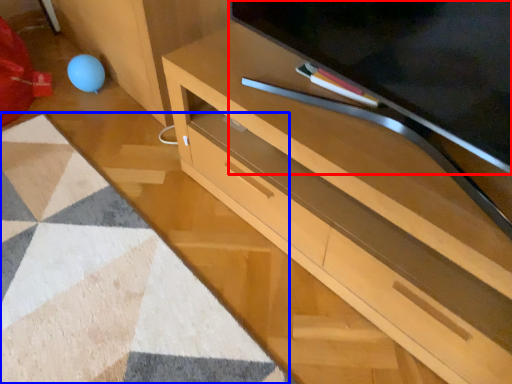
Question: Which of the following is the farthest to the observer, television (highlighted by a red box) or mat (highlighted by a blue box)?

Choices:
 (A) television
 (B) mat

Answer: (B)